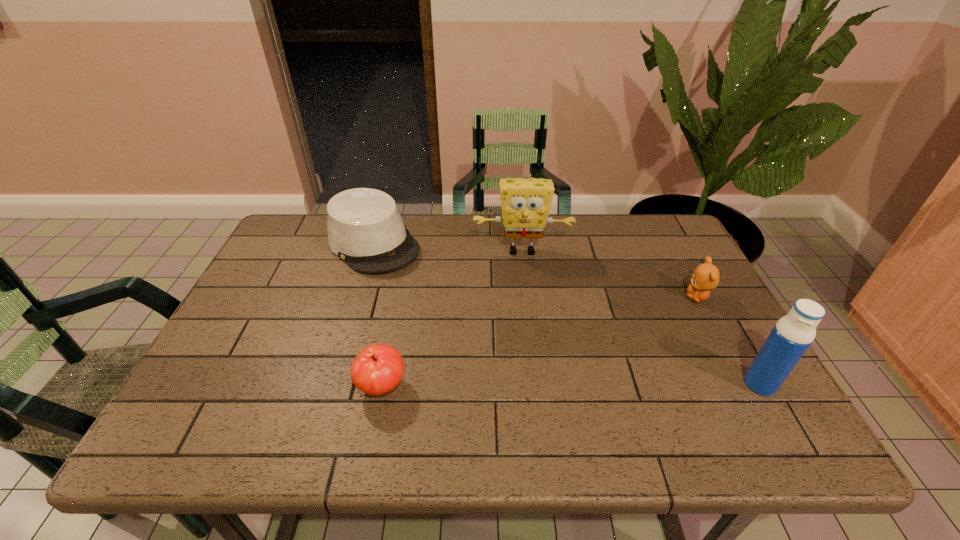
This screenshot has width=960, height=540. Identify the location of vacant position at the near left corner of the desktop. (263, 388).

Image resolution: width=960 pixels, height=540 pixels. In the image, there is a desktop. Identify the location of vacant space at the far right corner. 666,245.

In order to click on free space between the apple and the water bottle in this screenshot , I will do `click(571, 385)`.

I want to click on free space between the water bottle and the third nearest object, so click(x=729, y=341).

Locate an element on the screen. The image size is (960, 540). free point between the teddy bear and the hat is located at coordinates (536, 271).

The image size is (960, 540). Identify the location of blank region between the third nearest object and the third object from left to right. (610, 274).

I want to click on vacant area between the hat and the water bottle, so click(x=566, y=314).

You are a GUI agent. You are given a task and a screenshot of the screen. Output one action in this format:
    pyautogui.click(x=<x>, y=<y>)
    Task: Click on the vacant space that is in between the hat and the apple
    The width and height of the screenshot is (960, 540).
    Given the screenshot: What is the action you would take?
    pyautogui.click(x=377, y=315)

The height and width of the screenshot is (540, 960). Find the location of `vacant area between the sponge and the hat`. vacant area between the sponge and the hat is located at coordinates (447, 247).

You are a GUI agent. You are given a task and a screenshot of the screen. Output one action in this format:
    pyautogui.click(x=<x>, y=<y>)
    Task: Click on the vacant space that's between the apple and the sponge
    The height and width of the screenshot is (540, 960).
    Given the screenshot: What is the action you would take?
    pyautogui.click(x=452, y=319)